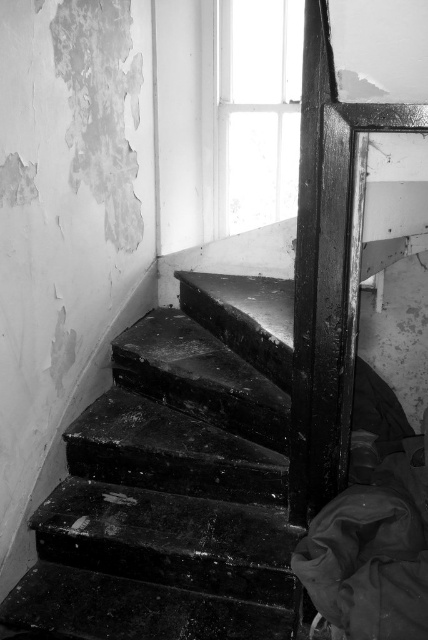
You are standing at the bottom of the black glossy stairs at center and want to reach the transparent glass window at upper center. Is the window above or below the stairs?

The transparent glass window at upper center is above the black glossy stairs at center because the stairs are positioned below the window.